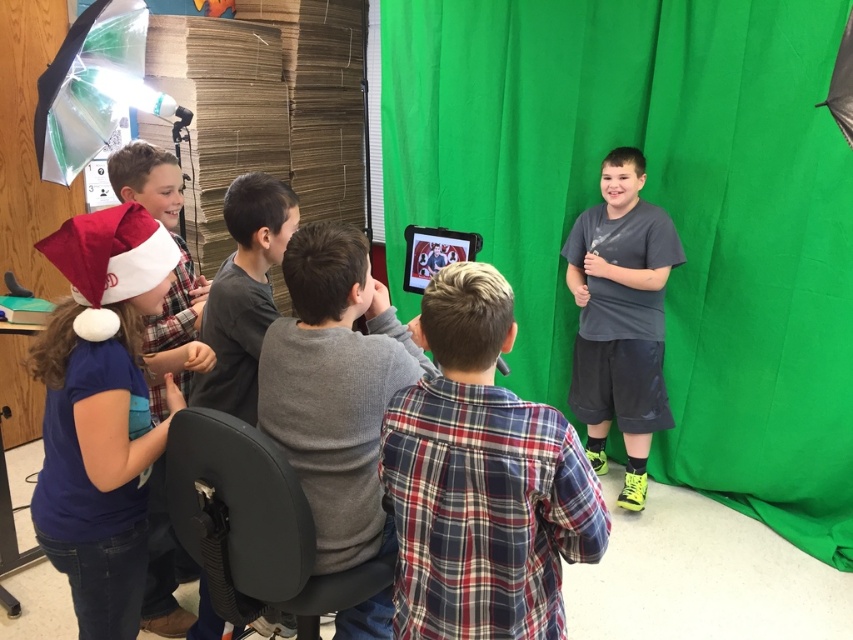
You are standing in the classroom where the children are working on their video project. You want to take a photo of the scene from a position that is exactly 5 feet away from the point marked as point (x=141, y=296). Is your current position correct?

The point (x=141, y=296) is 4.98 feet from the camera, so your current position is correct because it is within 0.02 feet of the desired 5 feet distance.

You are a photographer in the classroom setting. You need to position a 30 cm wide camera on the table between the blue cotton shirt at left and the gray matte shirt at center. Is there enough space between them to place the camera?

Result: The blue cotton shirt at left and gray matte shirt at center are 30.86 centimeters apart from each other. Since the camera is 30 cm wide, there is enough space between them to place the camera.